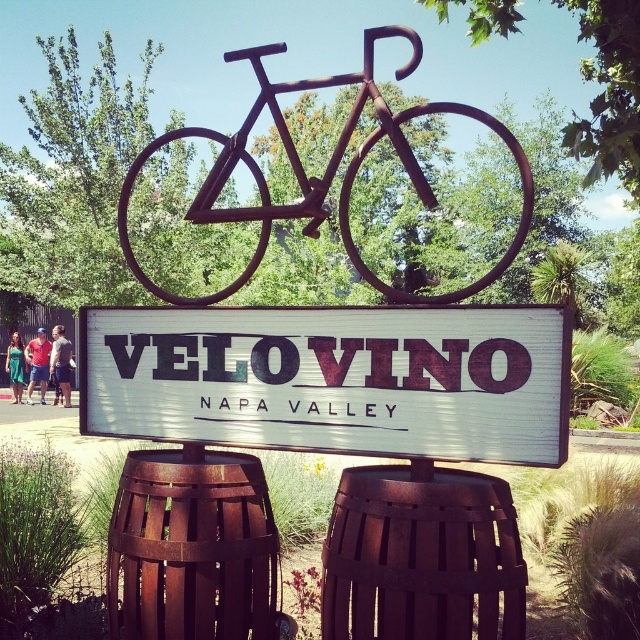
You are designing a new Velovino sign and want to ensure the white matte sign at center is visible above the rusty metal bicycle at center. Based on the current design, will the sign be visible above the bicycle?

The white matte sign at center has a lesser height compared to the rusty metal bicycle at center, so the sign will not be visible above the bicycle. You may need to adjust the positioning or size of the sign to ensure visibility.

You are a visitor at Velovino in Napa Valley. You see a white matte sign at center and a rusty metal bicycle at center. Which object is positioned higher up?

The rusty metal bicycle at center is positioned higher up because the white matte sign at center is below it.

Consider the image. You are standing at the Velovino sign in Napa Valley and want to place a small flag at two specific points. The first point is at coordinates point (381,508) and the second is at point (232,292). If you look from your current position, which point will appear closer to you?

Point (381,508) is in front of point (232,292), so it will appear closer to you.